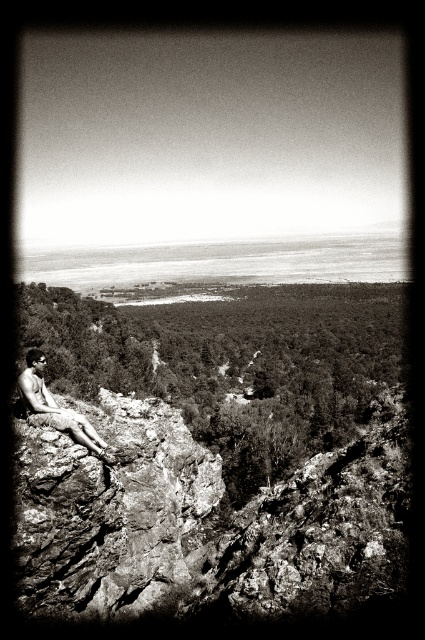
You are a photographer planning to place a tripod between the rough textured rock at left and the shiny skin man at lower left. Based on the scene description, which object is narrower so that the tripod can be placed closer to it?

The rough textured rock at left is thinner than the shiny skin man at lower left, so the tripod can be placed closer to the rough textured rock at left.

You are a photographer trying to capture the man in the scene. To ensure the rough textured rock at left is visible in the background, where should you position the shiny skin man at lower left relative to the rock?

The rough textured rock at left is located below the shiny skin man at lower left, so positioning the man above the rock will keep the rock visible in the background behind him.